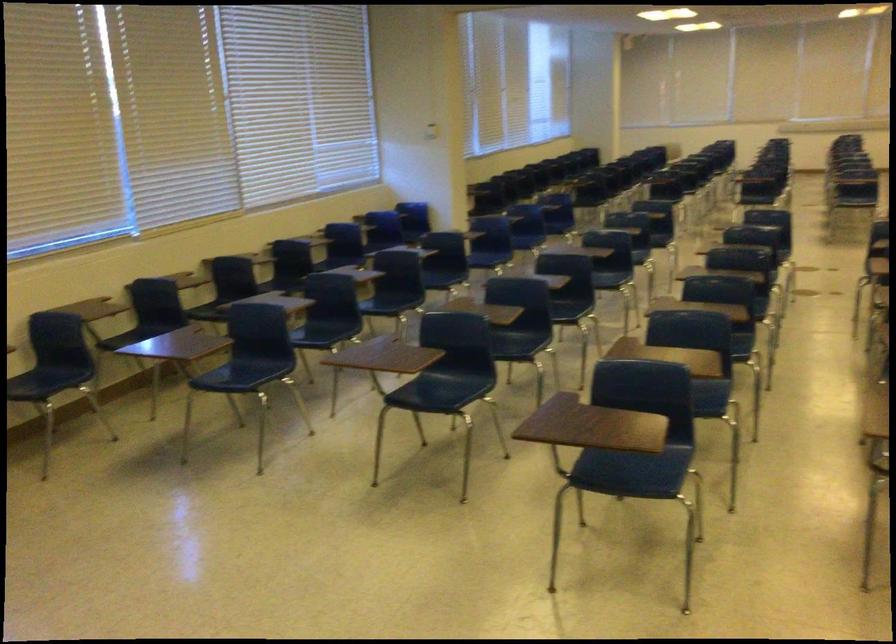
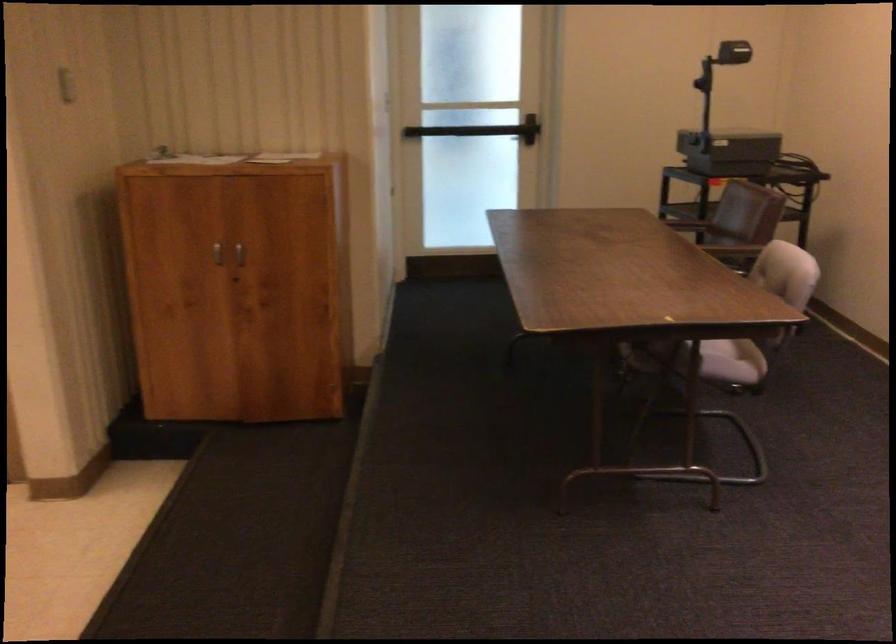
The images are taken continuously from a first-person perspective. In which direction is your viewpoint rotating?

The camera rotated toward right-down.